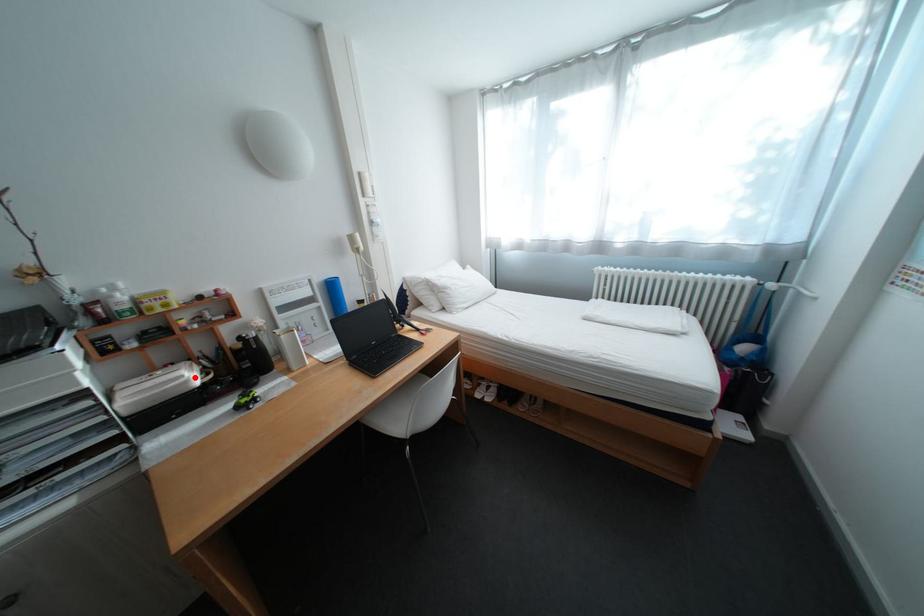
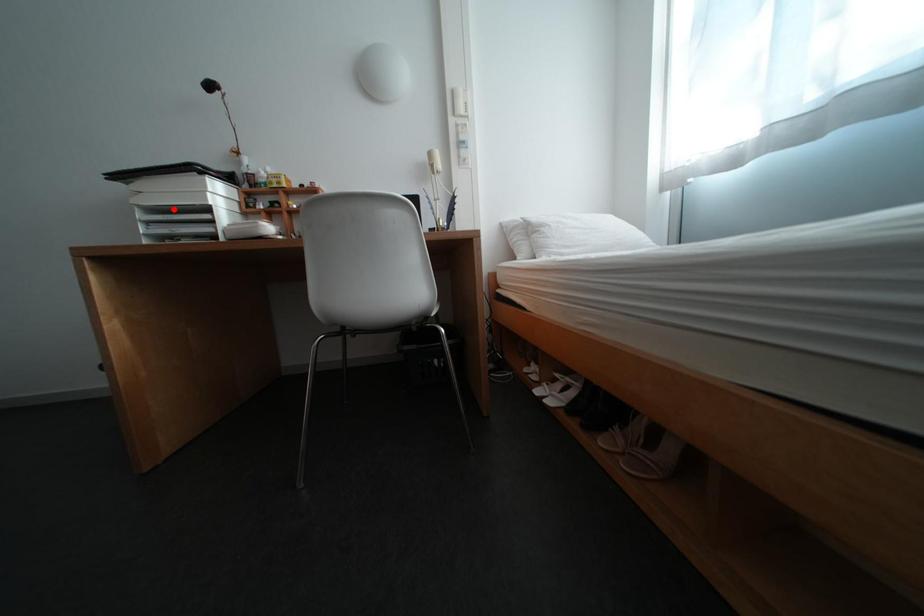
I am providing you with two images of the same scene from different viewpoints. A red point is marked on the first image and another point is marked on the second image. Is the red point in image1 aligned with the point shown in image2?

No